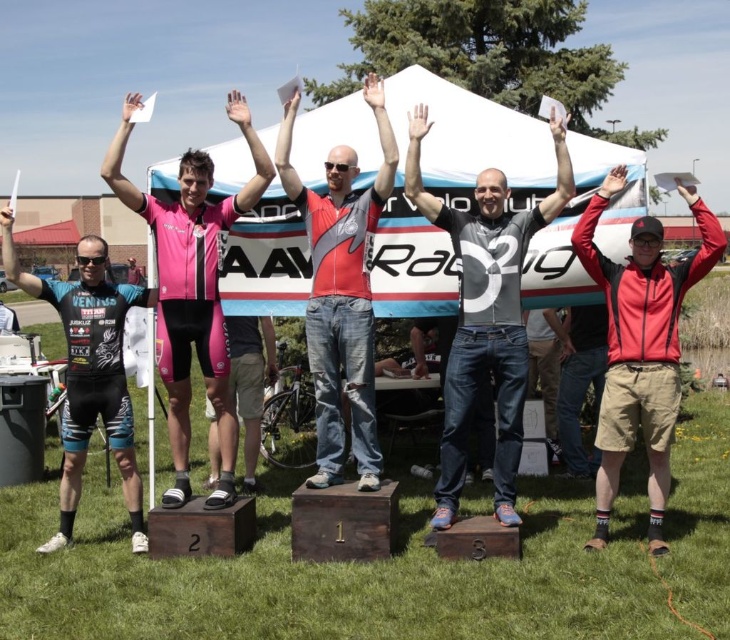
You are a photographer standing at the back of the podium area. You want to take a photo of both the red matte jacket at center and the pink matte cycling suit at center without any obstructions. Given that your camera has a maximum focus range of 3 meters, will you be able to capture both subjects clearly in the same shot?

The red matte jacket at center is 3.26 meters away from the pink matte cycling suit at center. Since the distance between them exceeds the camera maximum focus range of 3 meters, you cannot capture both subjects clearly in the same shot.